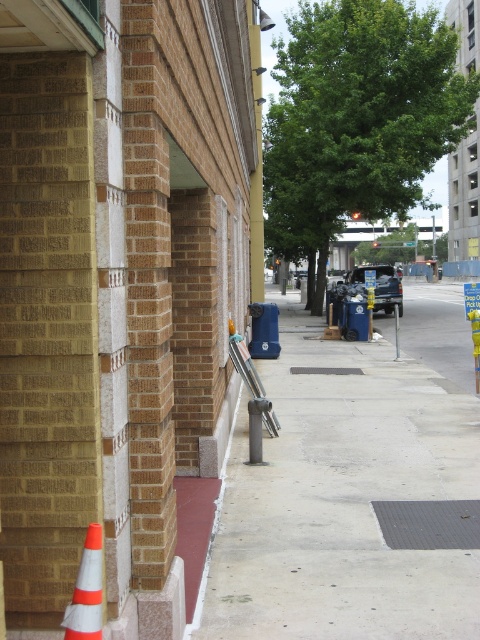
Question: Can you confirm if smooth concrete sidewalk at center is bigger than red rubber curb at lower left?

Choices:
 (A) no
 (B) yes

Answer: (B)

Question: Which point is farther from the camera taking this photo?

Choices:
 (A) (207, 570)
 (B) (274, 500)

Answer: (B)

Question: Which point appears closest to the camera in this image?

Choices:
 (A) (471, 586)
 (B) (206, 563)
 (C) (91, 577)

Answer: (C)

Question: Does smooth concrete sidewalk at center appear on the right side of orange/white striped cone at lower left?

Choices:
 (A) yes
 (B) no

Answer: (A)

Question: Is the position of orange/white striped cone at lower left less distant than that of red rubber curb at lower left?

Choices:
 (A) no
 (B) yes

Answer: (B)

Question: Which of the following is the farthest from the observer?

Choices:
 (A) smooth concrete sidewalk at center
 (B) red rubber curb at lower left
 (C) orange/white striped cone at lower left

Answer: (B)